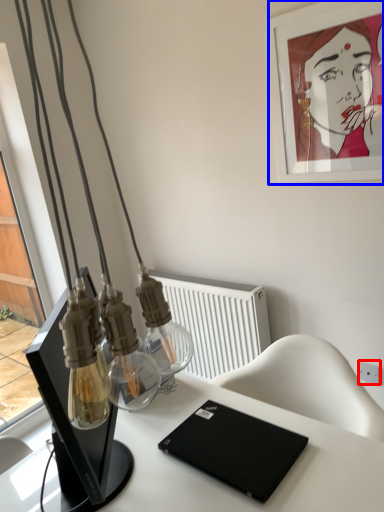
Question: Which object appears closest to the camera in this image, electric outlet (highlighted by a red box) or picture frame (highlighted by a blue box)?

Choices:
 (A) electric outlet
 (B) picture frame

Answer: (B)